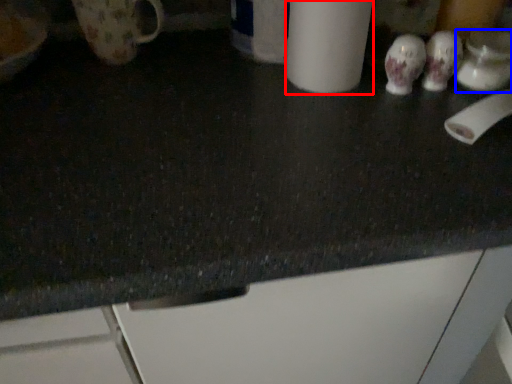
Question: Among these objects, which one is farthest to the camera, paper towel (highlighted by a red box) or mug (highlighted by a blue box)?

Choices:
 (A) paper towel
 (B) mug

Answer: (B)